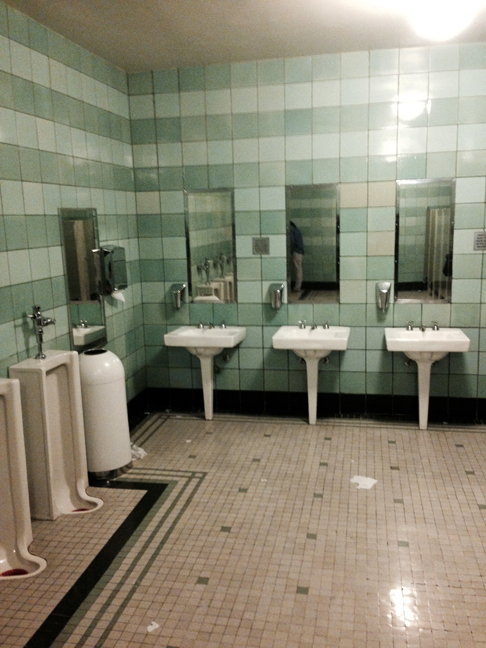
At what (x,y) coordinates should I click in order to perform the action: click on urinal. Please return your answer as a coordinate pair (x, y). Looking at the image, I should click on (51, 424), (9, 502).